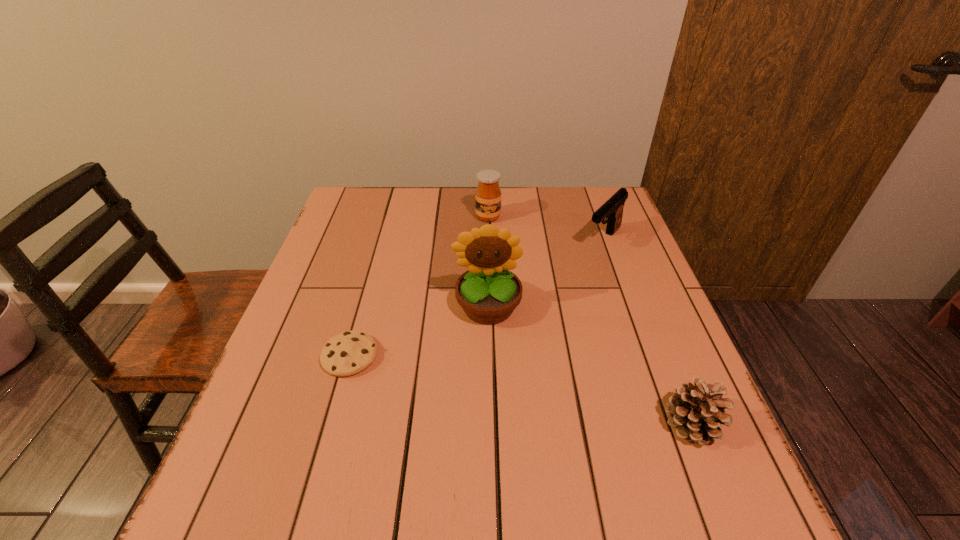
You are a GUI agent. You are given a task and a screenshot of the screen. Output one action in this format:
    pyautogui.click(x=<x>, y=<y>)
    Task: Click on the vacant space at the right edge
    Image resolution: width=960 pixels, height=540 pixels.
    Given the screenshot: What is the action you would take?
    pyautogui.click(x=681, y=338)

Where is `vacant space at the far left corner of the desktop`? Image resolution: width=960 pixels, height=540 pixels. vacant space at the far left corner of the desktop is located at coordinates (345, 194).

Image resolution: width=960 pixels, height=540 pixels. I want to click on vacant space at the near left corner of the desktop, so click(x=325, y=432).

This screenshot has width=960, height=540. I want to click on vacant space at the far right corner of the desktop, so click(x=583, y=223).

Identify the location of vacant area that lies between the tallest object and the nearest object. (590, 365).

What are the coordinates of `blank region between the tallest object and the nearest object` in the screenshot? It's located at click(x=590, y=365).

Where is `free point between the shortest object and the fourth tallest object`? This screenshot has width=960, height=540. free point between the shortest object and the fourth tallest object is located at coordinates coord(521,389).

Where is `free space between the shortest object and the sunflower`? free space between the shortest object and the sunflower is located at coordinates [419, 332].

Locate an element on the screen. Image resolution: width=960 pixels, height=540 pixels. free space between the honey and the second farthest object is located at coordinates (545, 228).

You are a GUI agent. You are given a task and a screenshot of the screen. Output one action in this format:
    pyautogui.click(x=<x>, y=<y>)
    Task: Click on the free spot between the sunflower and the cookie
    This screenshot has width=960, height=540.
    Given the screenshot: What is the action you would take?
    pyautogui.click(x=419, y=332)